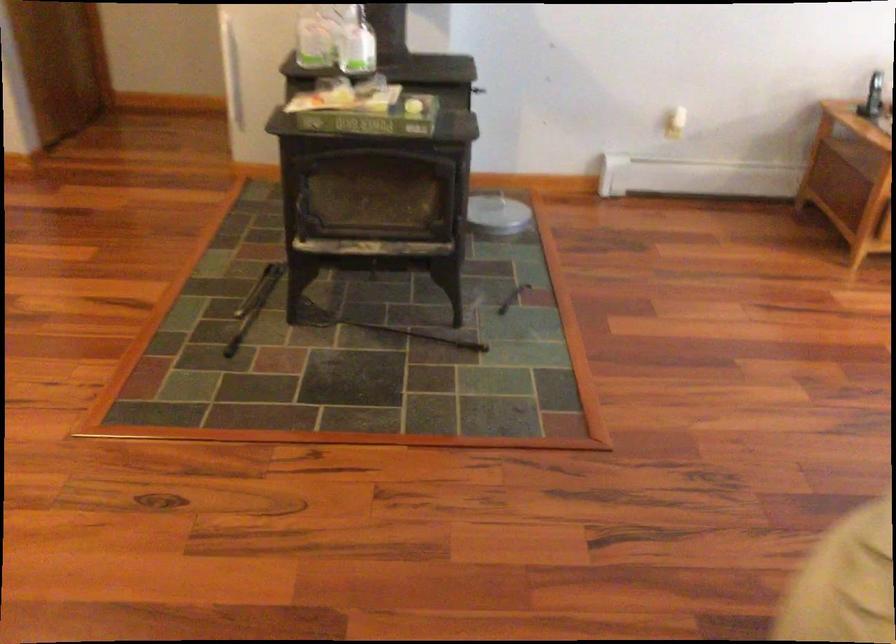
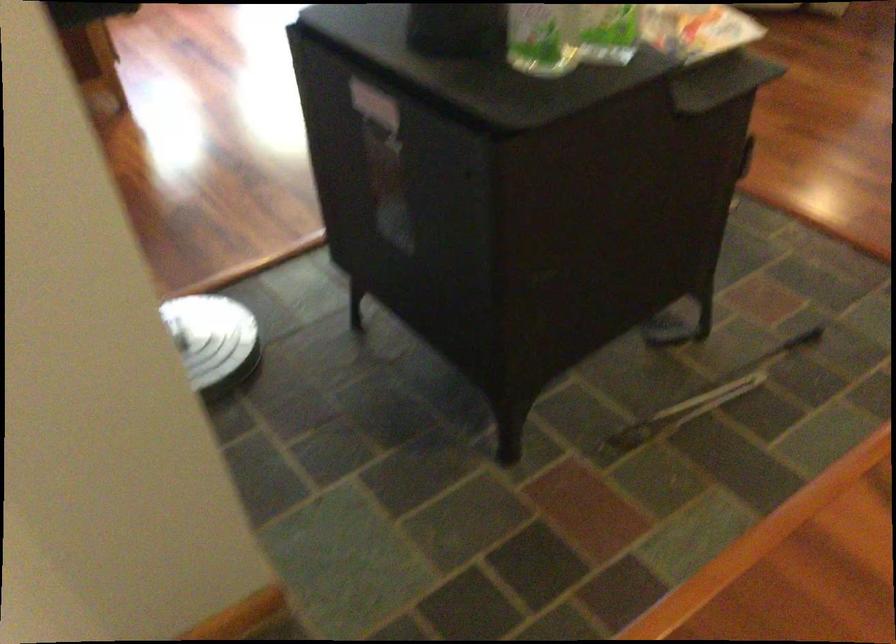
Locate, in the second image, the point that corresponds to point 252,289 in the first image.

(702, 399)